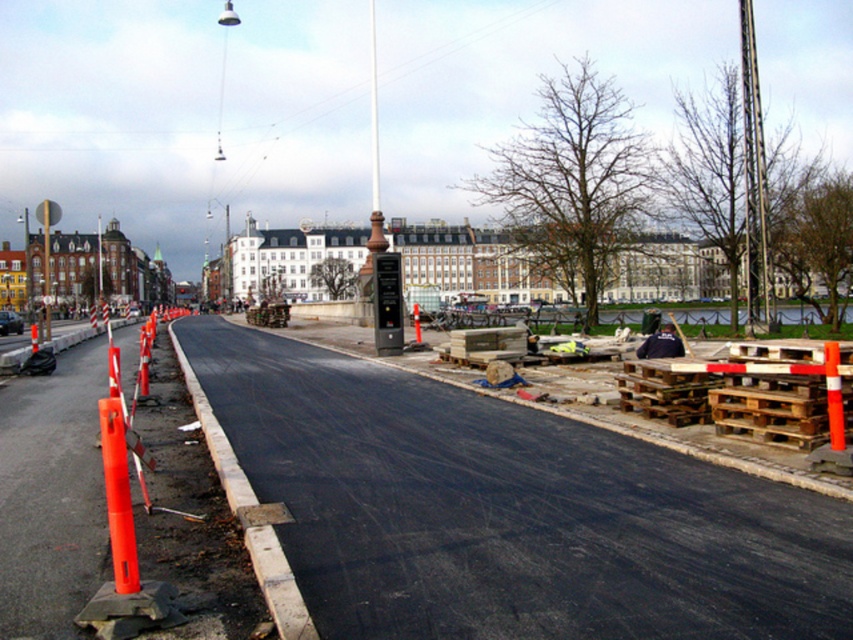
Is metallic pole at upper right smaller than orange plastic traffic cone at center-left?

No, metallic pole at upper right is not smaller than orange plastic traffic cone at center-left.

Which is in front, point (764, 246) or point (419, 337)?

Positioned in front is point (764, 246).

Locate an element on the screen. The height and width of the screenshot is (640, 853). metallic pole at upper right is located at coordinates (753, 176).

Does dark blue fabric at center appear over brushed metal pole at center?

No.

Does dark blue fabric at center have a greater width compared to brushed metal pole at center?

In fact, dark blue fabric at center might be narrower than brushed metal pole at center.

Is point (643, 340) more distant than point (47, 257)?

No.

Identify the location of dark blue fabric at center. This screenshot has width=853, height=640. (660, 342).

Can you confirm if wooden pallets at right is positioned above metallic pole at upper right?

Actually, wooden pallets at right is below metallic pole at upper right.

Which is in front, point (786, 380) or point (763, 163)?

Point (786, 380) is more forward.

Identify the location of wooden pallets at right. (741, 394).